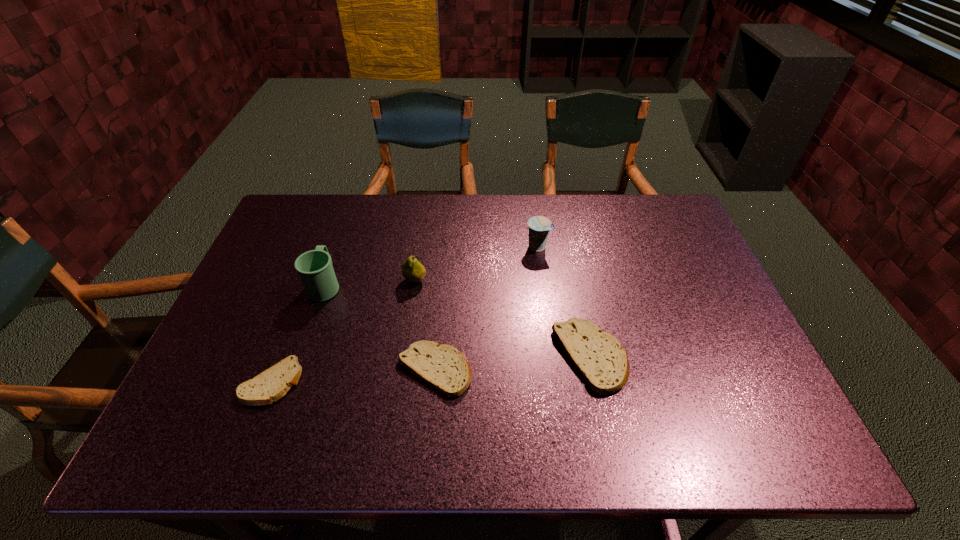
Where is `free point that satisfies the following two spatial constraints: 1. on the back side of the shortest pita bread; 2. on the right side of the pear`? free point that satisfies the following two spatial constraints: 1. on the back side of the shortest pita bread; 2. on the right side of the pear is located at coordinates (310, 280).